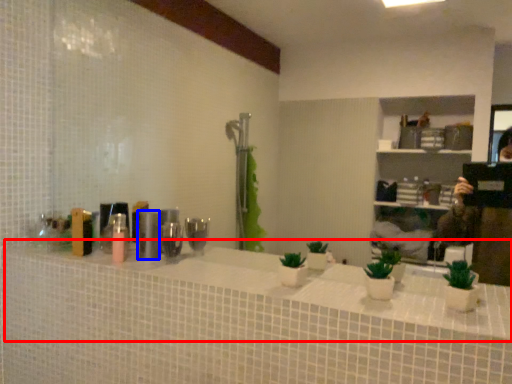
Question: Which of the following is the closest to the observer, counter top (highlighted by a red box) or toiletry (highlighted by a blue box)?

Choices:
 (A) counter top
 (B) toiletry

Answer: (A)